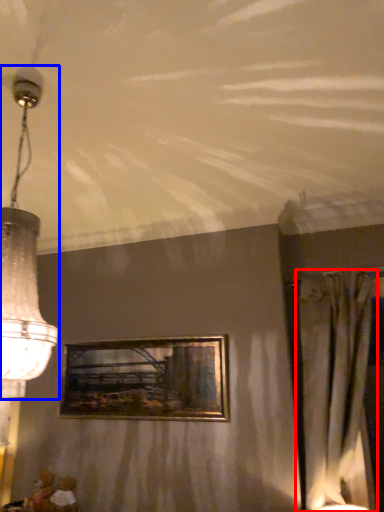
Question: Among these objects, which one is nearest to the camera, curtain (highlighted by a red box) or lamp (highlighted by a blue box)?

Choices:
 (A) curtain
 (B) lamp

Answer: (B)